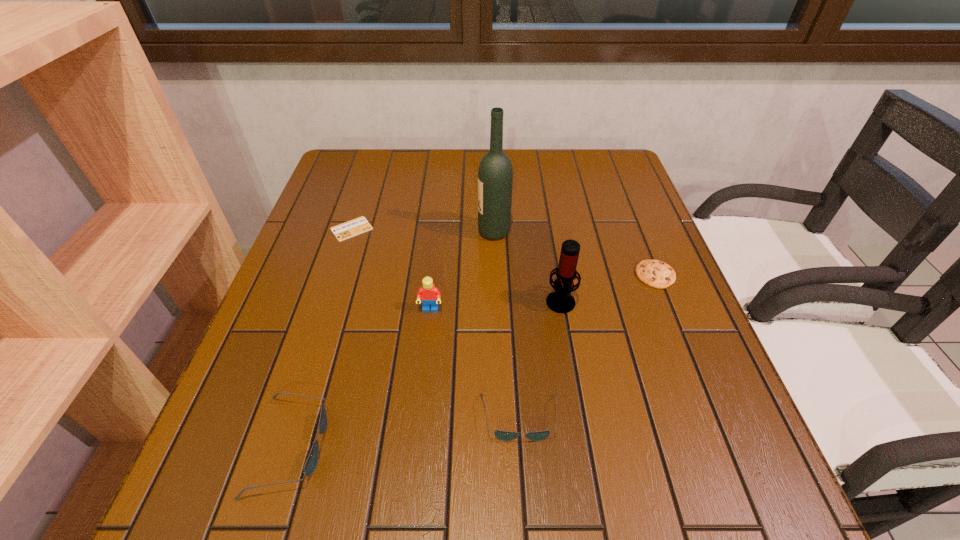
Find the location of a particular element. The image size is (960, 540). sunglasses located at the left edge is located at coordinates (310, 466).

Locate an element on the screen. The width and height of the screenshot is (960, 540). identity card situated at the left edge is located at coordinates (354, 227).

You are a GUI agent. You are given a task and a screenshot of the screen. Output one action in this format:
    pyautogui.click(x=<x>, y=<y>)
    Task: Click on the object at the right edge
    The image size is (960, 540).
    Given the screenshot: What is the action you would take?
    pyautogui.click(x=657, y=274)

The width and height of the screenshot is (960, 540). Identify the location of object that is at the near left corner. (310, 466).

Image resolution: width=960 pixels, height=540 pixels. I want to click on free region at the far edge of the desktop, so click(558, 160).

Locate an element on the screen. The image size is (960, 540). free space at the near edge is located at coordinates (567, 434).

This screenshot has width=960, height=540. In the image, there is a desktop. Find the location of `vacant area at the left edge`. vacant area at the left edge is located at coordinates (359, 241).

The image size is (960, 540). Find the location of `vacant space at the right edge of the desktop`. vacant space at the right edge of the desktop is located at coordinates (586, 208).

Locate an element on the screen. This screenshot has width=960, height=540. free space at the far left corner is located at coordinates (339, 154).

In the image, there is a desktop. Where is `vacant space at the near left corner`? The height and width of the screenshot is (540, 960). vacant space at the near left corner is located at coordinates (251, 441).